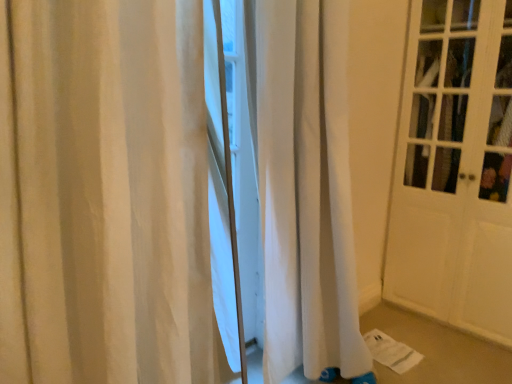
Question: From the image's perspective, is white fabric curtain at center beneath white wood door at right?

Choices:
 (A) yes
 (B) no

Answer: (A)

Question: Are white fabric curtain at center and white wood door at right making contact?

Choices:
 (A) no
 (B) yes

Answer: (A)

Question: Is white fabric curtain at center outside white wood door at right?

Choices:
 (A) no
 (B) yes

Answer: (B)

Question: Does white fabric curtain at center turn towards white wood door at right?

Choices:
 (A) no
 (B) yes

Answer: (A)

Question: Is white fabric curtain at center at the left side of white wood door at right?

Choices:
 (A) no
 (B) yes

Answer: (B)

Question: From a real-world perspective, is white fabric curtain at center located beneath white wood door at right?

Choices:
 (A) yes
 (B) no

Answer: (A)

Question: From the image's perspective, is white wood door at right located above white fabric curtain at center?

Choices:
 (A) yes
 (B) no

Answer: (A)

Question: Does white wood door at right lie behind white fabric curtain at center?

Choices:
 (A) yes
 (B) no

Answer: (A)

Question: Considering the relative sizes of white wood door at right and white fabric curtain at center in the image provided, is white wood door at right thinner than white fabric curtain at center?

Choices:
 (A) yes
 (B) no

Answer: (B)

Question: Is white wood door at right completely or partially outside of white fabric curtain at center?

Choices:
 (A) no
 (B) yes

Answer: (B)

Question: Is white wood door at right not near white fabric curtain at center?

Choices:
 (A) no
 (B) yes

Answer: (B)

Question: Can you confirm if white wood door at right is wider than white fabric curtain at center?

Choices:
 (A) yes
 (B) no

Answer: (A)

Question: Is white wood door at right in front of or behind white fabric curtain at center in the image?

Choices:
 (A) front
 (B) behind

Answer: (B)